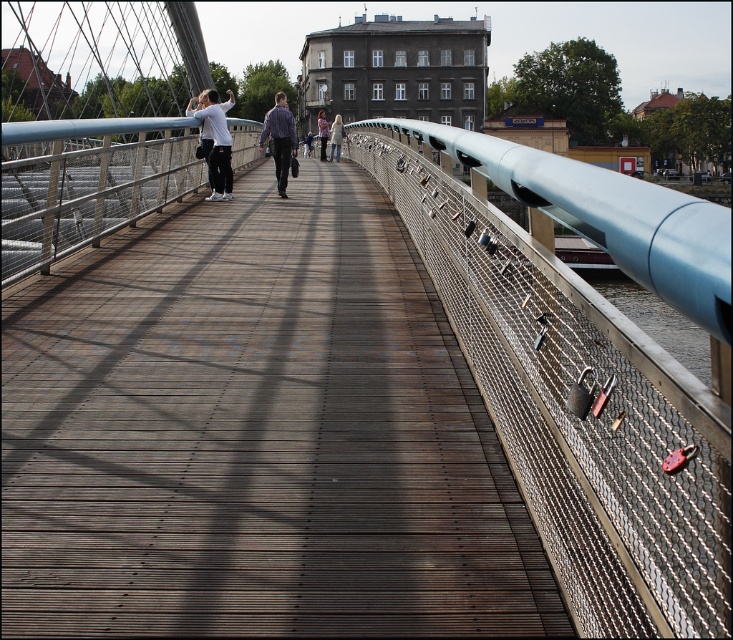
Can you confirm if wooden planks at center is positioned to the right of light brown leather jacket at center?

Correct, you'll find wooden planks at center to the right of light brown leather jacket at center.

Is point (388, 586) in front of point (323, 156)?

Yes, point (388, 586) is in front of point (323, 156).

Find the location of `wooden planks at center`. wooden planks at center is located at coordinates (257, 435).

Is point (166, 317) farther from camera compared to point (281, 108)?

No, it is in front of (281, 108).

Does wooden planks at center have a greater width compared to matte purple shirt at center?

Correct, the width of wooden planks at center exceeds that of matte purple shirt at center.

Does point (48, 500) come behind point (273, 157)?

No.

I want to click on wooden planks at center, so click(x=257, y=435).

Looking at this image, does white shirt at left have a smaller size compared to light brown leather jacket at center?

Yes.

Between point (213, 189) and point (323, 156), which one is positioned behind?

The point (323, 156) is behind.

Where is `white shirt at left`? white shirt at left is located at coordinates (216, 141).